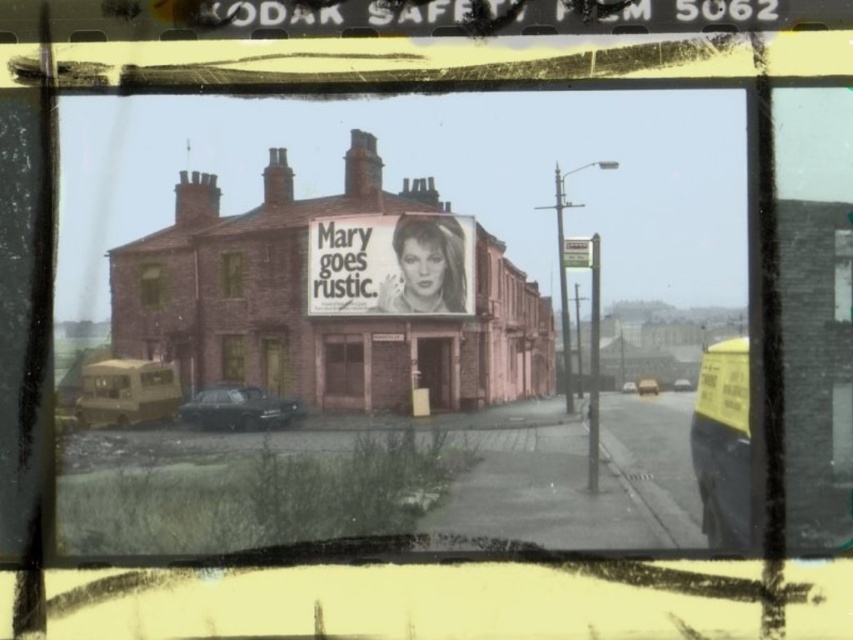
Question: Can you confirm if brick wall storefront at center is positioned below black and white poster at center?

Choices:
 (A) yes
 (B) no

Answer: (A)

Question: Which of these objects is positioned farthest from the shiny black car at lower left?

Choices:
 (A) metallic silver car at center
 (B) metallic gold van at center
 (C) black and white poster at center

Answer: (A)

Question: Does brick wall storefront at center appear on the right side of metallic silver van at center?

Choices:
 (A) no
 (B) yes

Answer: (A)

Question: Can you confirm if brick wall storefront at center is wider than white plastic sign at center?

Choices:
 (A) yes
 (B) no

Answer: (A)

Question: Estimate the real-world distances between objects in this image. Which object is closer to the metallic silver car at center?

Choices:
 (A) brick wall storefront at center
 (B) black and white poster at center
 (C) metallic silver van at center

Answer: (C)

Question: Which of the following is the closest to the observer?

Choices:
 (A) (474, 266)
 (B) (387, 288)
 (C) (282, 416)
 (D) (654, 384)

Answer: (D)